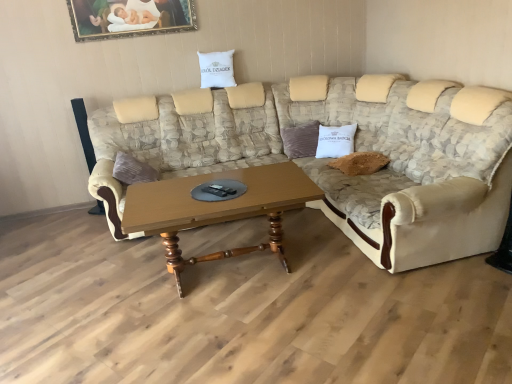
The image size is (512, 384). Describe the element at coordinates (217, 208) in the screenshot. I see `wooden polished coffee table at center` at that location.

What is the approximate width of wooden polished coffee table at center?

28.26 inches.

Describe the element at coordinates (217, 69) in the screenshot. This screenshot has width=512, height=384. I see `white cotton pillow at upper center, which is the second pillow from right to left` at that location.

What is the approximate height of gold-framed painting at upper center?

It is 35.34 centimeters.

What is the approximate height of white cotton pillow at center, marked as the first pillow in a right-to-left arrangement?

16.99 inches.

Find the location of `white cotton pillow at center, marked as the first pillow in a bottom-to-top arrangement`. white cotton pillow at center, marked as the first pillow in a bottom-to-top arrangement is located at coordinates (335, 141).

The image size is (512, 384). In order to click on wooden polished coffee table at center in this screenshot , I will do `click(217, 208)`.

Considering the relative positions of white cotton pillow at center, which is the second pillow from top to bottom, and gold-framed painting at upper center in the image provided, is white cotton pillow at center, which is the second pillow from top to bottom, to the right of gold-framed painting at upper center from the viewer's perspective?

Yes.

From a real-world perspective, is white cotton pillow at center, which is the second pillow from top to bottom, physically located above or below gold-framed painting at upper center?

From a real-world perspective, white cotton pillow at center, which is the second pillow from top to bottom, is physically below gold-framed painting at upper center.

How different are the orientations of white cotton pillow at center, marked as the first pillow in a bottom-to-top arrangement, and gold-framed painting at upper center in degrees?

There is a 36.5-degree angle between the facing directions of white cotton pillow at center, marked as the first pillow in a bottom-to-top arrangement, and gold-framed painting at upper center.

Is white cotton pillow at center, marked as the first pillow in a bottom-to-top arrangement, in front of or behind gold-framed painting at upper center in the image?

In the image, white cotton pillow at center, marked as the first pillow in a bottom-to-top arrangement, appears in front of gold-framed painting at upper center.

From the image's perspective, between beige fabric couch at center and wooden polished coffee table at center, who is located below?

From the image's view, wooden polished coffee table at center is below.

Can you tell me how much beige fabric couch at center and wooden polished coffee table at center differ in facing direction?

The angle between the facing direction of beige fabric couch at center and the facing direction of wooden polished coffee table at center is 1.57 degrees.

Is beige fabric couch at center oriented towards wooden polished coffee table at center?

Yes, beige fabric couch at center faces towards wooden polished coffee table at center.

Is beige fabric couch at center to the right of wooden polished coffee table at center from the viewer's perspective?

Indeed, beige fabric couch at center is positioned on the right side of wooden polished coffee table at center.

Looking at the image, does beige fabric couch at center seem bigger or smaller compared to white cotton pillow at center, the second pillow from the left?

In the image, beige fabric couch at center appears to be larger than white cotton pillow at center, the second pillow from the left.

Is the surface of beige fabric couch at center in direct contact with white cotton pillow at center, the second pillow from the left?

No, beige fabric couch at center is not with white cotton pillow at center, the second pillow from the left.

Would you say beige fabric couch at center is to the left or to the right of white cotton pillow at center, marked as the first pillow in a right-to-left arrangement, in the picture?

In the image, beige fabric couch at center appears on the left side of white cotton pillow at center, marked as the first pillow in a right-to-left arrangement.

Based on the photo, in the image, is beige fabric couch at center positioned in front of or behind white cotton pillow at center, which is the second pillow from top to bottom?

Clearly, beige fabric couch at center is in front of white cotton pillow at center, which is the second pillow from top to bottom.

Does gold-framed painting at upper center appear on the right side of beige fabric couch at center?

In fact, gold-framed painting at upper center is to the left of beige fabric couch at center.

How much distance is there between gold-framed painting at upper center and beige fabric couch at center?

gold-framed painting at upper center is 1.42 meters from beige fabric couch at center.

Can we say gold-framed painting at upper center lies outside beige fabric couch at center?

Indeed, gold-framed painting at upper center is completely outside beige fabric couch at center.

From their relative heights in the image, would you say gold-framed painting at upper center is taller or shorter than beige fabric couch at center?

In the image, gold-framed painting at upper center appears to be shorter than beige fabric couch at center.

Considering their positions, is gold-framed painting at upper center located in front of or behind wooden polished coffee table at center?

Visually, gold-framed painting at upper center is located behind wooden polished coffee table at center.

Is gold-framed painting at upper center aimed at wooden polished coffee table at center?

No.

How different are the orientations of gold-framed painting at upper center and wooden polished coffee table at center in degrees?

1.62 degrees separate the facing orientations of gold-framed painting at upper center and wooden polished coffee table at center.

From a real-world perspective, is gold-framed painting at upper center above or below wooden polished coffee table at center?

gold-framed painting at upper center is situated higher than wooden polished coffee table at center in the real world.

In terms of size, does white cotton pillow at upper center, which is the first pillow from left to right, appear bigger or smaller than gold-framed painting at upper center?

Clearly, white cotton pillow at upper center, which is the first pillow from left to right, is larger in size than gold-framed painting at upper center.

The image size is (512, 384). I want to click on picture frame above the white cotton pillow at upper center, which is the second pillow from right to left (from the image's perspective), so click(x=129, y=18).

Is gold-framed painting at upper center at the back of white cotton pillow at upper center, which ranks as the second pillow in bottom-to-top order?

white cotton pillow at upper center, which ranks as the second pillow in bottom-to-top order, does not have its back to gold-framed painting at upper center.

Based on their positions, is white cotton pillow at upper center, which ranks as the second pillow in bottom-to-top order, located to the left or right of gold-framed painting at upper center?

Based on their positions, white cotton pillow at upper center, which ranks as the second pillow in bottom-to-top order, is located to the right of gold-framed painting at upper center.

Which object is closer to the camera, beige fabric couch at center or gold-framed painting at upper center?

beige fabric couch at center is more forward.

What's the angular difference between beige fabric couch at center and gold-framed painting at upper center's facing directions?

The facing directions of beige fabric couch at center and gold-framed painting at upper center are 0.0466 degrees apart.

From the image's perspective, is beige fabric couch at center beneath gold-framed painting at upper center?

Yes, from the image's perspective, beige fabric couch at center is beneath gold-framed painting at upper center.

Does beige fabric couch at center have a greater height compared to gold-framed painting at upper center?

Indeed, beige fabric couch at center has a greater height compared to gold-framed painting at upper center.

The image size is (512, 384). What are the coordinates of `picture frame above the white cotton pillow at center, which is the second pillow from top to bottom (from the image's perspective)` in the screenshot? It's located at (129, 18).

The height and width of the screenshot is (384, 512). I want to click on studio couch on the right of wooden polished coffee table at center, so click(328, 159).

Which object lies nearer to the anchor point gold-framed painting at upper center, wooden polished coffee table at center or beige fabric couch at center?

beige fabric couch at center is closer to gold-framed painting at upper center.

From the image, which object appears to be nearer to white cotton pillow at upper center, which is the first pillow from left to right, gold-framed painting at upper center or beige fabric couch at center?

gold-framed painting at upper center is positioned closer to the anchor white cotton pillow at upper center, which is the first pillow from left to right.

Estimate the real-world distances between objects in this image. Which object is further from white cotton pillow at center, the second pillow from the left, white cotton pillow at upper center, which is the second pillow from right to left, or wooden polished coffee table at center?

Among the two, wooden polished coffee table at center is located further to white cotton pillow at center, the second pillow from the left.

Which object lies further to the anchor point white cotton pillow at center, marked as the first pillow in a bottom-to-top arrangement, gold-framed painting at upper center or wooden polished coffee table at center?

gold-framed painting at upper center is positioned further to the anchor white cotton pillow at center, marked as the first pillow in a bottom-to-top arrangement.

Consider the image. Considering their positions, is wooden polished coffee table at center positioned further to white cotton pillow at center, marked as the first pillow in a right-to-left arrangement, than white cotton pillow at upper center, placed as the first pillow when sorted from top to bottom?

wooden polished coffee table at center lies further to white cotton pillow at center, marked as the first pillow in a right-to-left arrangement, than the other object.

Based on their spatial positions, is white cotton pillow at upper center, which is the second pillow from right to left, or beige fabric couch at center further from gold-framed painting at upper center?

Among the two, beige fabric couch at center is located further to gold-framed painting at upper center.

Which object lies further to the anchor point gold-framed painting at upper center, white cotton pillow at upper center, which ranks as the second pillow in bottom-to-top order, or white cotton pillow at center, marked as the first pillow in a bottom-to-top arrangement?

white cotton pillow at center, marked as the first pillow in a bottom-to-top arrangement.

Estimate the real-world distances between objects in this image. Which object is further from gold-framed painting at upper center, white cotton pillow at center, which is the second pillow from top to bottom, or beige fabric couch at center?

white cotton pillow at center, which is the second pillow from top to bottom.

At what (x,y) coordinates should I click in order to perform the action: click on pillow positioned between beige fabric couch at center and gold-framed painting at upper center from near to far. Please return your answer as a coordinate pair (x, y). This screenshot has width=512, height=384. Looking at the image, I should click on (335, 141).

At what (x,y) coordinates should I click in order to perform the action: click on pillow between gold-framed painting at upper center and white cotton pillow at center, which is the second pillow from top to bottom, from left to right. Please return your answer as a coordinate pair (x, y). This screenshot has height=384, width=512. Looking at the image, I should click on (217, 69).

I want to click on coffee table located between beige fabric couch at center and white cotton pillow at upper center, which is the first pillow from left to right, in the depth direction, so pos(217,208).

The image size is (512, 384). Find the location of `pillow between beige fabric couch at center and white cotton pillow at upper center, which is the second pillow from right to left, in the front-back direction`. pillow between beige fabric couch at center and white cotton pillow at upper center, which is the second pillow from right to left, in the front-back direction is located at coordinates point(335,141).